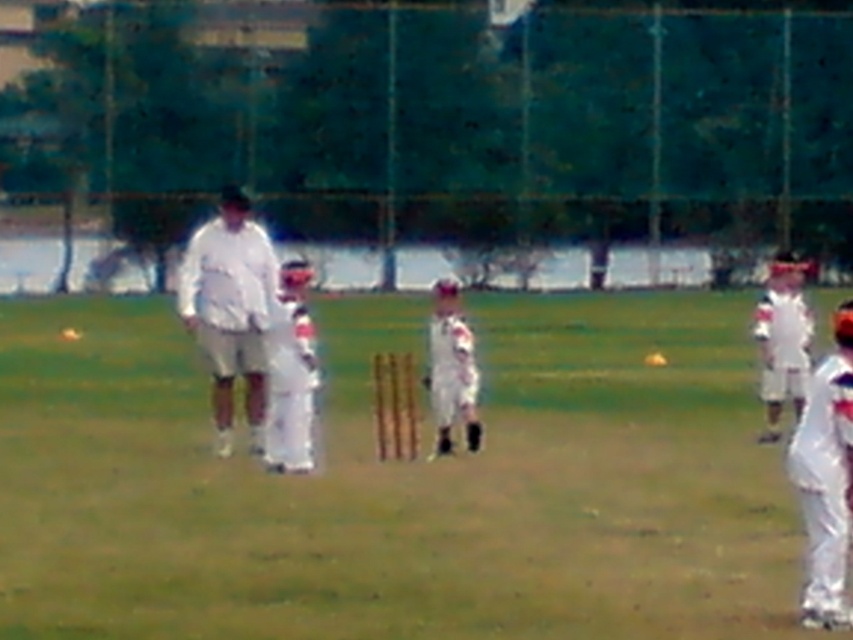
Question: Can you confirm if white fabric cricket bat at center is positioned to the left of white matte cricket bat at center?

Choices:
 (A) no
 (B) yes

Answer: (A)

Question: Which is nearer to the white matte baseball uniform at center?

Choices:
 (A) white fabric cricket bat at center
 (B) white fabric baseball uniform at center
 (C) white matte baseball uniform at right

Answer: (B)

Question: Considering the real-world distances, which object is closest to the white matte cricket bat at center?

Choices:
 (A) white fabric uniform at right
 (B) white matte baseball uniform at center
 (C) white matte baseball uniform at right

Answer: (B)

Question: Considering the relative positions of white matte cricket bat at center and white matte baseball uniform at center in the image provided, where is white matte cricket bat at center located with respect to white matte baseball uniform at center?

Choices:
 (A) right
 (B) left

Answer: (B)

Question: Is white fabric cricket bat at center wider than white matte baseball uniform at center?

Choices:
 (A) no
 (B) yes

Answer: (B)

Question: Which of the following is the farthest from the observer?

Choices:
 (A) (476, 392)
 (B) (808, 364)
 (C) (222, 384)

Answer: (B)